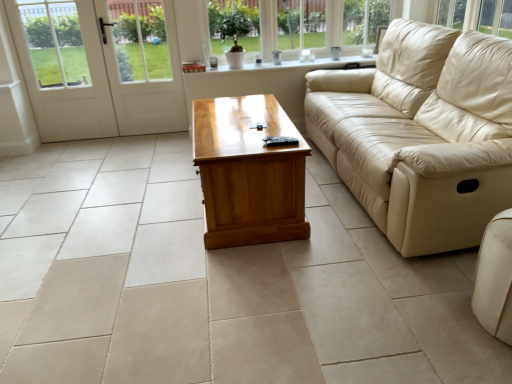
At what (x,y) coordinates should I click in order to perform the action: click on beige leather couch at lower right, the 1th studio couch in the bottom-to-top sequence. Please return your answer as a coordinate pair (x, y). Looking at the image, I should click on (495, 278).

This screenshot has width=512, height=384. Describe the element at coordinates (248, 172) in the screenshot. I see `light brown wood coffee table at center` at that location.

I want to click on beige leather couch at lower right, which appears as the first studio couch when viewed from the front, so click(x=495, y=278).

In the image, is white glossy door at left positioned in front of or behind white wooden screen door at left?

white glossy door at left is in front of white wooden screen door at left.

From the image's perspective, which one is positioned lower, white glossy door at left or white wooden screen door at left?

From the image's view, white glossy door at left is below.

Between white glossy door at left and white wooden screen door at left, which one appears on the left side from the viewer's perspective?

From the viewer's perspective, white glossy door at left appears more on the left side.

Would you consider white glossy door at left to be distant from white wooden screen door at left?

No, white glossy door at left is not far from white wooden screen door at left.

Do you think white glossy door at left is within beige leather couch at right, marked as the first studio couch in a back-to-front arrangement, or outside of it?

white glossy door at left cannot be found inside beige leather couch at right, marked as the first studio couch in a back-to-front arrangement.

From the image's perspective, is white glossy door at left above beige leather couch at right, the second studio couch when ordered from front to back?

Yes, from the image's perspective, white glossy door at left is over beige leather couch at right, the second studio couch when ordered from front to back.

Considering the sizes of white glossy door at left and beige leather couch at right, the second studio couch when ordered from front to back, in the image, is white glossy door at left bigger or smaller than beige leather couch at right, the second studio couch when ordered from front to back,?

Considering their sizes, white glossy door at left takes up less space than beige leather couch at right, the second studio couch when ordered from front to back.

Considering the points (132, 114) and (502, 324), which point is behind, point (132, 114) or point (502, 324)?

The point (132, 114) is farther from the camera.

From a real-world perspective, between white wooden screen door at left and beige leather couch at lower right, which appears as the first studio couch when viewed from the front, who is vertically higher?

In real-world perspective, white wooden screen door at left is above.

Is white wooden screen door at left facing away from beige leather couch at lower right, the 1th studio couch in the bottom-to-top sequence?

No, white wooden screen door at left is not facing away from beige leather couch at lower right, the 1th studio couch in the bottom-to-top sequence.

Which of these two, white wooden screen door at left or beige leather couch at lower right, marked as the 2th studio couch in a top-to-bottom arrangement, is thinner?

white wooden screen door at left is thinner.

From the image's perspective, is white wooden screen door at left located above or below beige leather couch at right, marked as the first studio couch in a back-to-front arrangement?

Answer: Clearly, from the image's perspective, white wooden screen door at left is above beige leather couch at right, marked as the first studio couch in a back-to-front arrangement.

Which point is more forward, (142, 108) or (334, 133)?

Point (334, 133)

Considering the relative sizes of white wooden screen door at left and beige leather couch at right, marked as the first studio couch in a back-to-front arrangement, in the image provided, is white wooden screen door at left thinner than beige leather couch at right, marked as the first studio couch in a back-to-front arrangement,?

Correct, the width of white wooden screen door at left is less than that of beige leather couch at right, marked as the first studio couch in a back-to-front arrangement.

Would you consider white wooden screen door at left to be distant from beige leather couch at right, the second studio couch when ordered from front to back?

Yes.

Based on the photo, how far apart are clear glass window at upper center and light brown wood coffee table at center?

clear glass window at upper center and light brown wood coffee table at center are 5.12 feet apart.

Where is `window behind the light brown wood coffee table at center`? window behind the light brown wood coffee table at center is located at coordinates (300, 26).

Is light brown wood coffee table at center located within clear glass window at upper center?

Definitely not — light brown wood coffee table at center is not inside clear glass window at upper center.

Considering the sizes of clear glass window at upper center and light brown wood coffee table at center in the image, is clear glass window at upper center wider or thinner than light brown wood coffee table at center?

In the image, clear glass window at upper center appears to be more narrow than light brown wood coffee table at center.

From the picture: Can you confirm if beige leather couch at right, the 1th studio couch positioned from the top, is smaller than light brown wood coffee table at center?

Actually, beige leather couch at right, the 1th studio couch positioned from the top, might be larger than light brown wood coffee table at center.

From the image's perspective, is beige leather couch at right, marked as the first studio couch in a back-to-front arrangement, located beneath light brown wood coffee table at center?

No.

Between point (458, 138) and point (246, 118), which one is positioned behind?

The point (246, 118) is more distant.

Which object is positioned more to the right, beige leather couch at right, the second studio couch when ordered from front to back, or light brown wood coffee table at center?

From the viewer's perspective, beige leather couch at right, the second studio couch when ordered from front to back, appears more on the right side.

Find the location of `coffee table located above the beige leather couch at lower right, the 2th studio couch viewed from the back (from a real-world perspective)`. coffee table located above the beige leather couch at lower right, the 2th studio couch viewed from the back (from a real-world perspective) is located at coordinates (248, 172).

From the image's perspective, which one is positioned higher, beige leather couch at lower right, the 1th studio couch in the bottom-to-top sequence, or light brown wood coffee table at center?

light brown wood coffee table at center, from the image's perspective.

Which object is closer to the camera, beige leather couch at lower right, the 2th studio couch viewed from the back, or light brown wood coffee table at center?

beige leather couch at lower right, the 2th studio couch viewed from the back.

Is beige leather couch at lower right, the 1th studio couch in the bottom-to-top sequence, wider or thinner than light brown wood coffee table at center?

Considering their sizes, beige leather couch at lower right, the 1th studio couch in the bottom-to-top sequence, looks slimmer than light brown wood coffee table at center.

You are a GUI agent. You are given a task and a screenshot of the screen. Output one action in this format:
    pyautogui.click(x=<x>, y=<y>)
    Task: Click on the screen door that is behind the white glossy door at left
    The image size is (512, 384).
    Given the screenshot: What is the action you would take?
    pyautogui.click(x=149, y=92)

At what (x,y) coordinates should I click in order to perform the action: click on door on the left of beige leather couch at right, positioned as the 2th studio couch in bottom-to-top order. Please return your answer as a coordinate pair (x, y). The height and width of the screenshot is (384, 512). Looking at the image, I should click on (100, 66).

From the image, which object appears to be farther from beige leather couch at right, the 1th studio couch positioned from the top, beige leather couch at lower right, which appears as the first studio couch when viewed from the front, or light brown wood coffee table at center?

beige leather couch at lower right, which appears as the first studio couch when viewed from the front.

From the image, which object appears to be farther from beige leather couch at right, marked as the first studio couch in a back-to-front arrangement, light brown wood coffee table at center or white wooden screen door at left?

Based on the image, white wooden screen door at left appears to be further to beige leather couch at right, marked as the first studio couch in a back-to-front arrangement.

From the image, which object appears to be nearer to light brown wood coffee table at center, white glossy door at left or white wooden screen door at left?

white wooden screen door at left is closer to light brown wood coffee table at center.

Looking at the image, which one is located closer to beige leather couch at lower right, the 2th studio couch viewed from the back, light brown wood coffee table at center or white glossy door at left?

light brown wood coffee table at center.

Which object lies further to the anchor point white glossy door at left, white wooden screen door at left or beige leather couch at lower right, marked as the 2th studio couch in a top-to-bottom arrangement?

The object further to white glossy door at left is beige leather couch at lower right, marked as the 2th studio couch in a top-to-bottom arrangement.

Estimate the real-world distances between objects in this image. Which object is further from clear glass window at upper center, beige leather couch at lower right, marked as the 2th studio couch in a top-to-bottom arrangement, or white glossy door at left?

Based on the image, beige leather couch at lower right, marked as the 2th studio couch in a top-to-bottom arrangement, appears to be further to clear glass window at upper center.

Based on their spatial positions, is light brown wood coffee table at center or beige leather couch at lower right, the 2th studio couch viewed from the back, closer to beige leather couch at right, positioned as the 2th studio couch in bottom-to-top order?

light brown wood coffee table at center.

When comparing their distances from white glossy door at left, does white wooden screen door at left or light brown wood coffee table at center seem closer?

Among the two, white wooden screen door at left is located nearer to white glossy door at left.

Identify the location of coffee table between white glossy door at left and beige leather couch at right, marked as the first studio couch in a back-to-front arrangement, from left to right. The image size is (512, 384). (248, 172).

The image size is (512, 384). Find the location of `screen door located between white glossy door at left and beige leather couch at right, the second studio couch when ordered from front to back, in the left-right direction`. screen door located between white glossy door at left and beige leather couch at right, the second studio couch when ordered from front to back, in the left-right direction is located at coordinates (149, 92).

Where is `coffee table positioned between beige leather couch at lower right, marked as the 2th studio couch in a top-to-bottom arrangement, and white wooden screen door at left from near to far`? Image resolution: width=512 pixels, height=384 pixels. coffee table positioned between beige leather couch at lower right, marked as the 2th studio couch in a top-to-bottom arrangement, and white wooden screen door at left from near to far is located at coordinates (248, 172).

Locate an element on the screen. The image size is (512, 384). coffee table between beige leather couch at lower right, which appears as the first studio couch when viewed from the front, and clear glass window at upper center, along the z-axis is located at coordinates (248, 172).